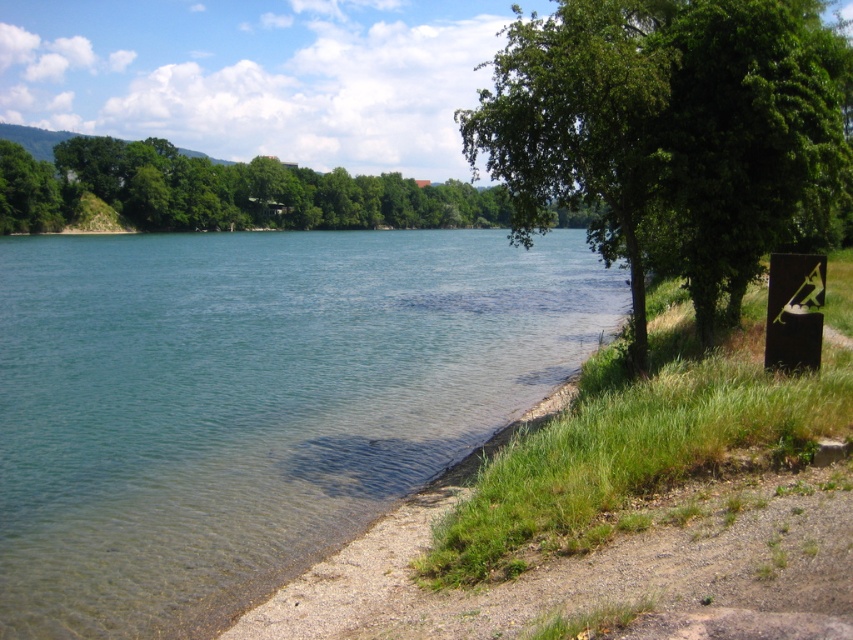
Question: Which object is farther from the camera taking this photo?

Choices:
 (A) green leafy tree at upper left
 (B) green leafy tree at center

Answer: (A)

Question: Considering the relative positions of green leafy tree at center and green leafy tree at upper left in the image provided, where is green leafy tree at center located with respect to green leafy tree at upper left?

Choices:
 (A) right
 (B) left

Answer: (A)

Question: Is clear water at shore left to the right of green leafy tree at center from the viewer's perspective?

Choices:
 (A) no
 (B) yes

Answer: (A)

Question: Which object is positioned farthest from the green leafy tree at upper left?

Choices:
 (A) green leafy tree at center
 (B) clear water at shore left

Answer: (A)

Question: Is green leafy tree at center to the right of green leafy tree at upper left from the viewer's perspective?

Choices:
 (A) yes
 (B) no

Answer: (A)

Question: Which of these objects is positioned farthest from the green leafy tree at center?

Choices:
 (A) green leafy tree at upper left
 (B) clear water at shore left

Answer: (A)